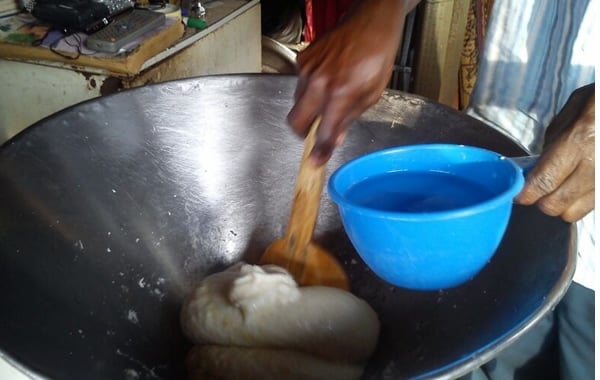
You are a GUI agent. You are given a task and a screenshot of the screen. Output one action in this format:
    pyautogui.click(x=<x>, y=<y>)
    Task: Click on the junk on floor
    This screenshot has height=380, width=600.
    Given the screenshot: What is the action you would take?
    pyautogui.click(x=290, y=39)